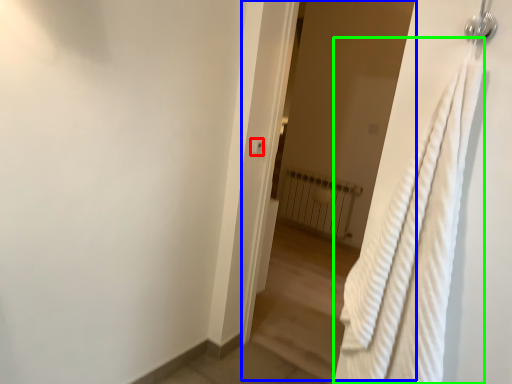
Question: Considering the real-world distances, which object is closest to light switch (highlighted by a red box)? screen door (highlighted by a blue box) or bath towel (highlighted by a green box).

Choices:
 (A) screen door
 (B) bath towel

Answer: (B)